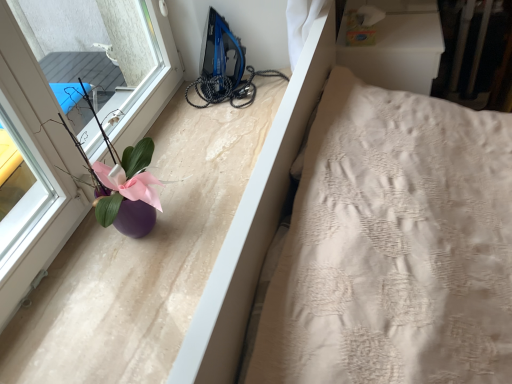
Question: From a real-world perspective, does purple glossy vase at left sit lower than purple matte vase at left?

Choices:
 (A) no
 (B) yes

Answer: (B)

Question: Can you confirm if purple glossy vase at left is bigger than purple matte vase at left?

Choices:
 (A) yes
 (B) no

Answer: (B)

Question: From the image's perspective, is purple glossy vase at left located beneath purple matte vase at left?

Choices:
 (A) no
 (B) yes

Answer: (B)

Question: Considering the relative sizes of purple glossy vase at left and purple matte vase at left in the image provided, is purple glossy vase at left wider than purple matte vase at left?

Choices:
 (A) no
 (B) yes

Answer: (B)

Question: Considering the relative sizes of purple glossy vase at left and purple matte vase at left in the image provided, is purple glossy vase at left taller than purple matte vase at left?

Choices:
 (A) yes
 (B) no

Answer: (B)

Question: Is purple glossy vase at left completely or partially outside of purple matte vase at left?

Choices:
 (A) yes
 (B) no

Answer: (A)

Question: Are purple matte vase at left and purple glossy vase at left making contact?

Choices:
 (A) yes
 (B) no

Answer: (B)

Question: Considering the relative sizes of purple matte vase at left and purple glossy vase at left in the image provided, is purple matte vase at left smaller than purple glossy vase at left?

Choices:
 (A) no
 (B) yes

Answer: (A)

Question: Can you confirm if purple matte vase at left is wider than purple glossy vase at left?

Choices:
 (A) no
 (B) yes

Answer: (A)

Question: Is purple matte vase at left looking in the opposite direction of purple glossy vase at left?

Choices:
 (A) yes
 (B) no

Answer: (A)

Question: From a real-world perspective, is purple matte vase at left over purple glossy vase at left?

Choices:
 (A) no
 (B) yes

Answer: (B)

Question: Can we say purple matte vase at left lies outside purple glossy vase at left?

Choices:
 (A) yes
 (B) no

Answer: (A)

Question: From the image's perspective, is purple glossy vase at left positioned above or below purple matte vase at left?

Choices:
 (A) above
 (B) below

Answer: (B)